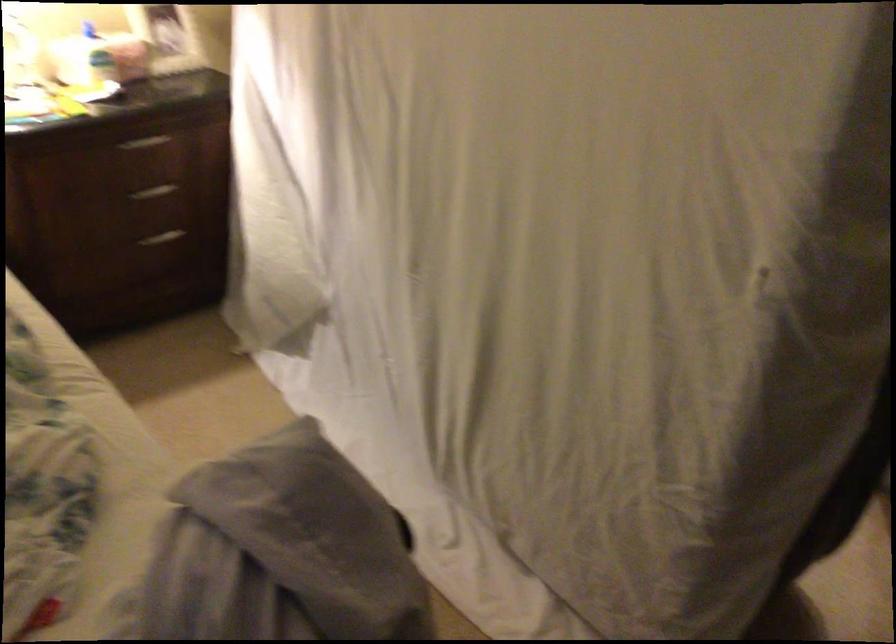
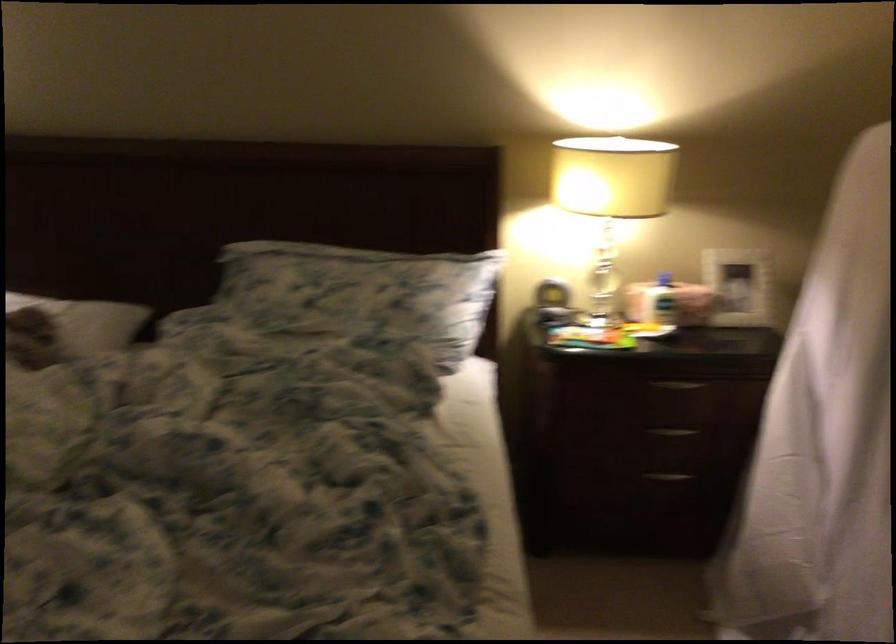
Where in the second image is the point corresponding to point 161,243 from the first image?

(668, 476)